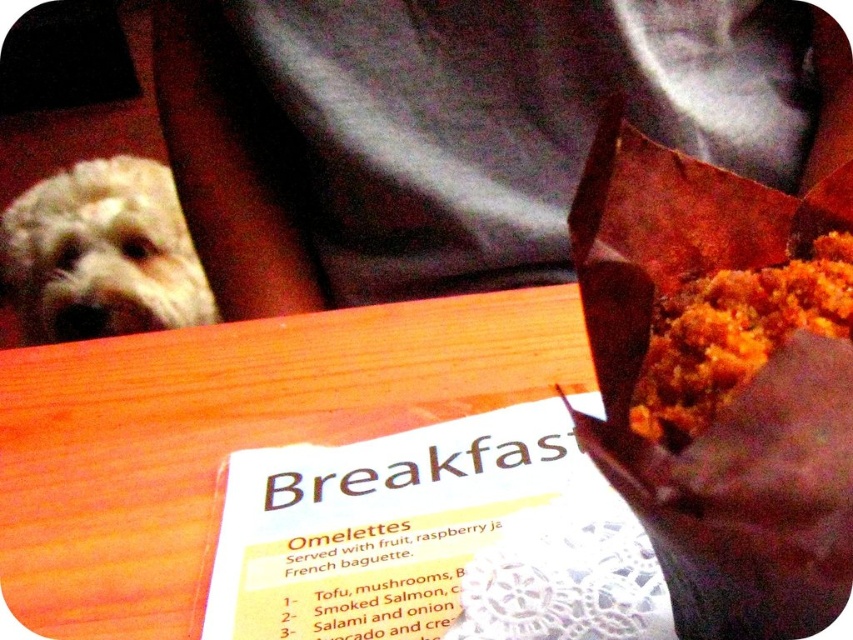
Is white fluffy dog at upper left taller than golden crumbly muffin at upper right?

Yes, white fluffy dog at upper left is taller than golden crumbly muffin at upper right.

Is point (154, 243) positioned behind point (848, 269)?

Yes, point (154, 243) is behind point (848, 269).

Identify the location of white fluffy dog at upper left. The width and height of the screenshot is (853, 640). (102, 253).